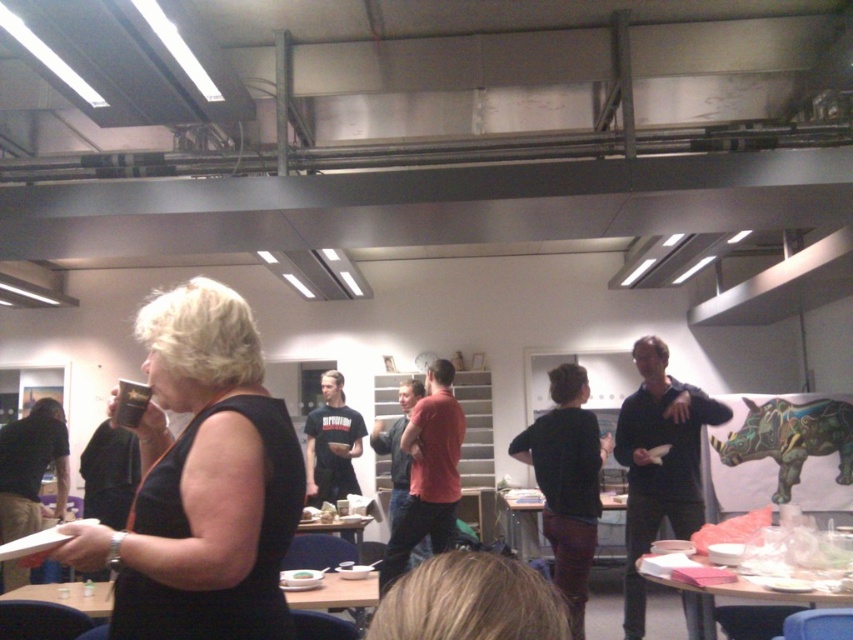
You are organizing a small event and need to place a decorative item on the table. The table has limited space. Given the presence of the matte black dress at center and the white matte plate at center, which object should you avoid placing another item near to ensure it doesn

You should avoid placing another item near the matte black dress at center because it is larger in size than the white matte plate at center, taking up more space on the table.

You are a photographer setting up for a group photo. You want to position yourself exactly 1.5 meters away from the matte black dress at center to ensure everyone is in frame. Is your current position correct?

The matte black dress at center is currently 1.20 meters away from the camera. Since you want to be 1.5 meters away, you need to move back an additional 0.3 meters to achieve the desired distance.

You are organizing a small event and need to arrange items on a table. You have a matte black dress at center and a white matte plate at center. According to the scene, where should you place the matte black dress relative to the white matte plate?

The matte black dress at center should be placed to the right of the white matte plate at center as per the scene description.